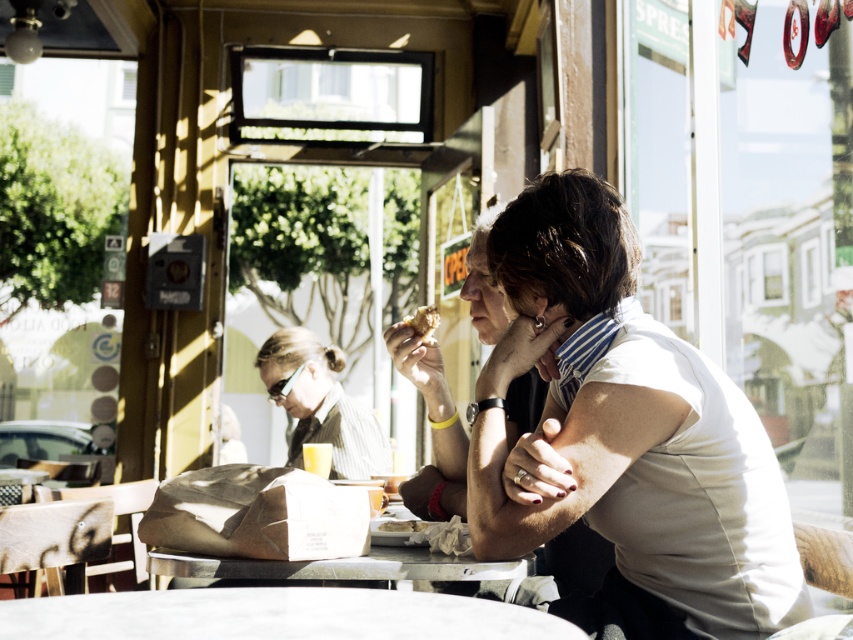
Is matte black sunglasses at center to the right of metallic reflective table at center from the viewer's perspective?

No, matte black sunglasses at center is not to the right of metallic reflective table at center.

In order to click on matte black sunglasses at center in this screenshot , I will do `click(320, 403)`.

You are a GUI agent. You are given a task and a screenshot of the screen. Output one action in this format:
    pyautogui.click(x=<x>, y=<y>)
    Task: Click on the matte black sunglasses at center
    
    Given the screenshot: What is the action you would take?
    pyautogui.click(x=320, y=403)

Between golden crispy pastry at center and white paper bag at center, which one is positioned higher?

golden crispy pastry at center is higher up.

Does golden crispy pastry at center appear on the left side of white paper bag at center?

No, golden crispy pastry at center is not to the left of white paper bag at center.

This screenshot has height=640, width=853. What do you see at coordinates (422, 321) in the screenshot?
I see `golden crispy pastry at center` at bounding box center [422, 321].

Locate an element on the screen. golden crispy pastry at center is located at coordinates (422, 321).

Which is above, white matte shirt at center or golden crispy pastry at center?

Positioned higher is golden crispy pastry at center.

Consider the image. Between white matte shirt at center and golden crispy pastry at center, which one appears on the left side from the viewer's perspective?

golden crispy pastry at center is more to the left.

The width and height of the screenshot is (853, 640). I want to click on white matte shirt at center, so click(627, 435).